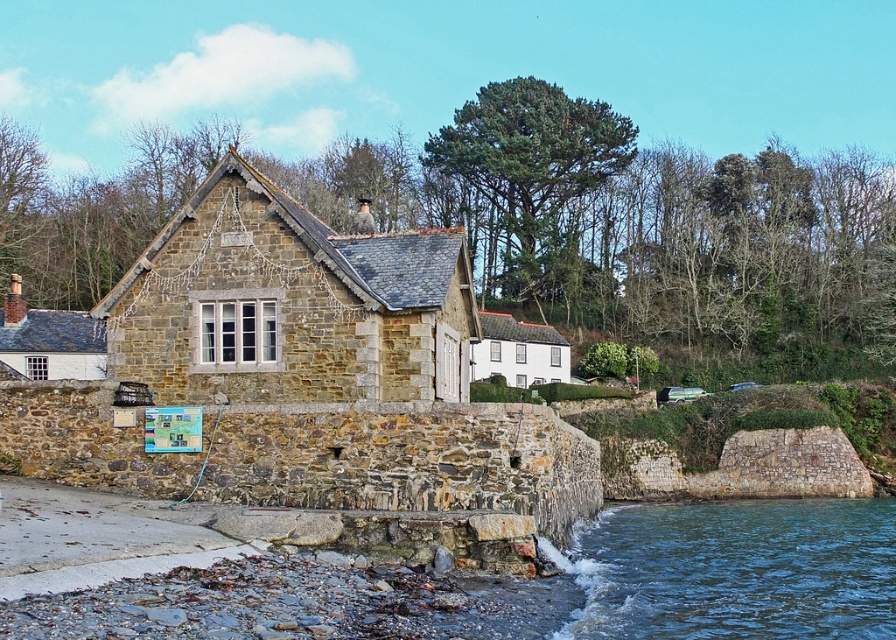
In the scene shown: You are standing at the point marked as point (x=868, y=541). The building in front of you has a signboard near the entrance. Can you read the text on the signboard from your current position?

The point (x=868, y=541) is 194.69 feet away from the viewer. Since the distance is quite large, it would be difficult to read the text on the signboard from that position.